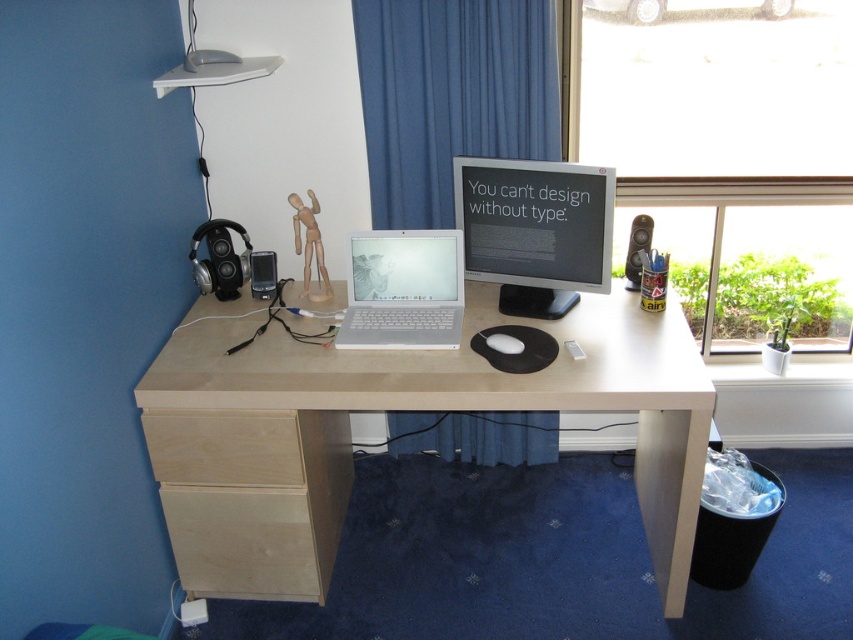
Which of these two, bare wood drawer at lower left or black plastic speaker at right, stands shorter?

black plastic speaker at right is shorter.

Which is more to the right, bare wood drawer at lower left or black plastic speaker at right?

From the viewer's perspective, black plastic speaker at right appears more on the right side.

In order to click on bare wood drawer at lower left in this screenshot , I will do tap(245, 541).

Is black plastic speaker at right closer to camera compared to white matte mouse at center?

That is False.

Is black plastic speaker at right to the right of white matte mouse at center from the viewer's perspective?

Indeed, black plastic speaker at right is positioned on the right side of white matte mouse at center.

Describe the element at coordinates (637, 250) in the screenshot. I see `black plastic speaker at right` at that location.

Image resolution: width=853 pixels, height=640 pixels. What are the coordinates of `black plastic speaker at right` in the screenshot? It's located at (637, 250).

Looking at this image, does transparent glass window at upper right lie in front of blue fabric curtain at center?

That is False.

The image size is (853, 640). In order to click on transparent glass window at upper right in this screenshot , I will do `click(733, 161)`.